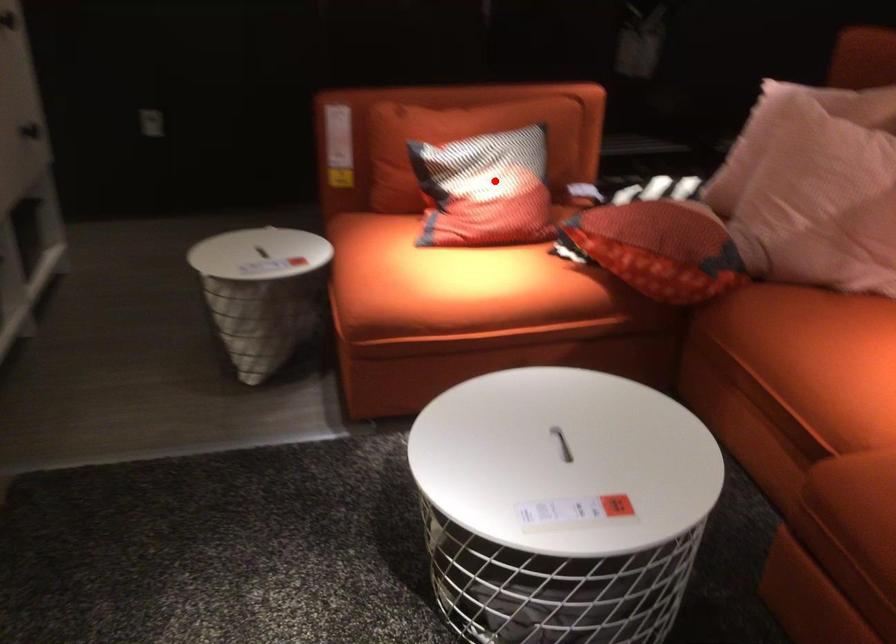
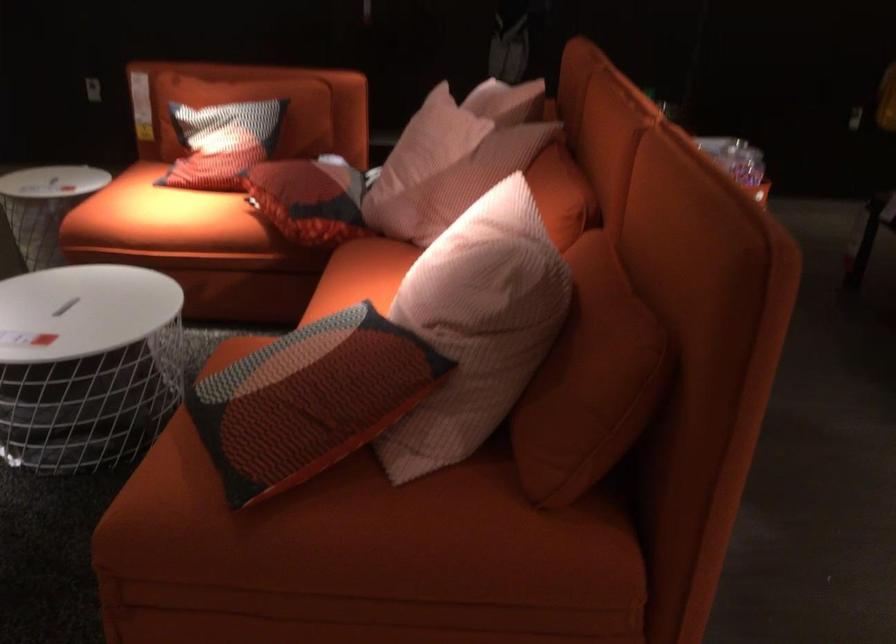
Locate, in the second image, the point that corresponds to the highlighted location in the first image.

(222, 142)